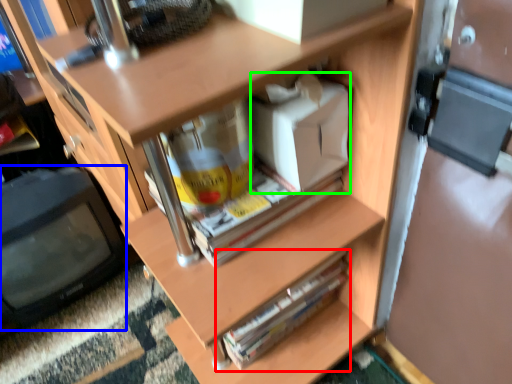
Question: Considering the real-world distances, which object is closest to paperback book (highlighted by a red box)? computer monitor (highlighted by a blue box) or box (highlighted by a green box).

Choices:
 (A) computer monitor
 (B) box

Answer: (B)